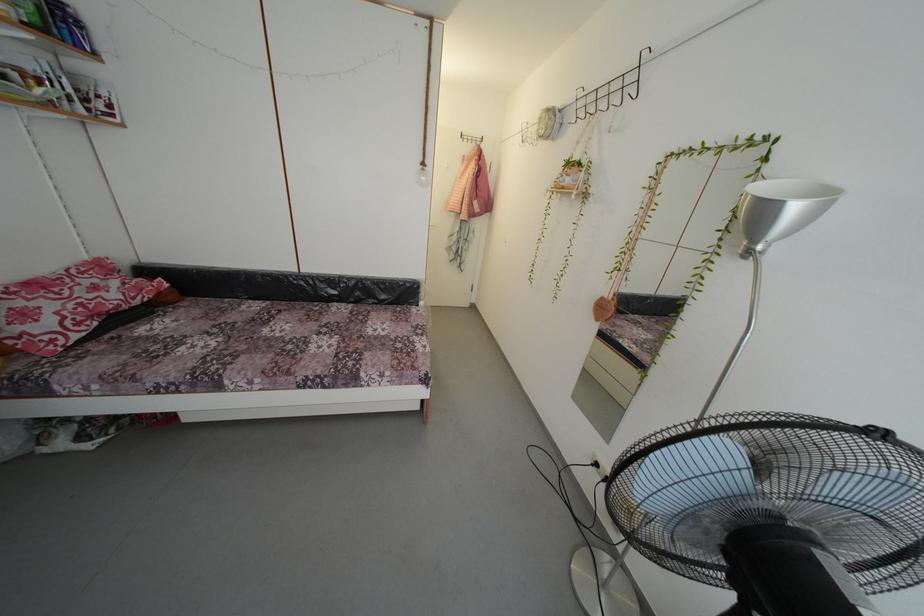
Locate an element on the screen. The width and height of the screenshot is (924, 616). hanging lightbulb is located at coordinates (422, 176).